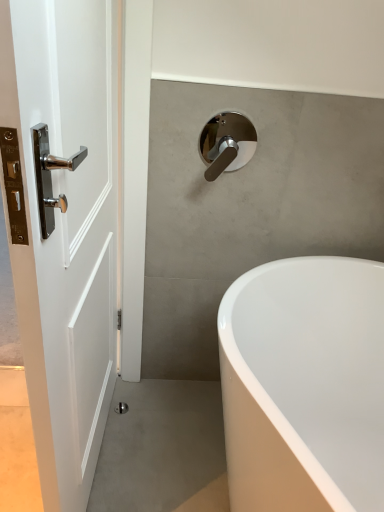
Question: From a real-world perspective, is chrome metallic tap at upper center below white glossy door at left?

Choices:
 (A) yes
 (B) no

Answer: (B)

Question: Considering the relative sizes of chrome metallic tap at upper center and white glossy door at left in the image provided, is chrome metallic tap at upper center smaller than white glossy door at left?

Choices:
 (A) yes
 (B) no

Answer: (A)

Question: Is chrome metallic tap at upper center closer to the viewer compared to white glossy door at left?

Choices:
 (A) yes
 (B) no

Answer: (B)

Question: From the image's perspective, would you say chrome metallic tap at upper center is shown under white glossy door at left?

Choices:
 (A) yes
 (B) no

Answer: (B)

Question: Is chrome metallic tap at upper center oriented towards white glossy door at left?

Choices:
 (A) yes
 (B) no

Answer: (B)

Question: Does chrome metallic tap at upper center come behind white glossy door at left?

Choices:
 (A) no
 (B) yes

Answer: (B)

Question: From a real-world perspective, is white glossy bathtub at lower right on white glossy door at left?

Choices:
 (A) no
 (B) yes

Answer: (A)

Question: From a real-world perspective, is white glossy bathtub at lower right below white glossy door at left?

Choices:
 (A) no
 (B) yes

Answer: (B)

Question: Is white glossy bathtub at lower right directly adjacent to white glossy door at left?

Choices:
 (A) yes
 (B) no

Answer: (B)

Question: From the image's perspective, is white glossy bathtub at lower right on top of white glossy door at left?

Choices:
 (A) yes
 (B) no

Answer: (B)

Question: Is white glossy bathtub at lower right not within white glossy door at left?

Choices:
 (A) no
 (B) yes

Answer: (B)

Question: Can you confirm if white glossy bathtub at lower right is positioned to the right of white glossy door at left?

Choices:
 (A) no
 (B) yes

Answer: (B)

Question: Considering the relative sizes of white glossy door at left and white glossy bathtub at lower right in the image provided, is white glossy door at left thinner than white glossy bathtub at lower right?

Choices:
 (A) no
 (B) yes

Answer: (B)